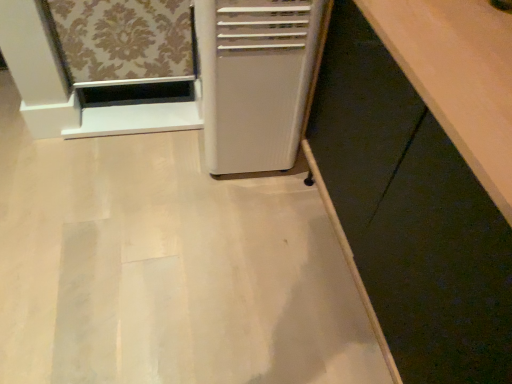
Question: Should I look upward or downward to see white plastic air conditioner at center?

Choices:
 (A) up
 (B) down

Answer: (A)

Question: Is matte white cabinet at lower right far from white plastic air conditioner at center?

Choices:
 (A) yes
 (B) no

Answer: (B)

Question: Would you say white plastic air conditioner at center is part of matte white cabinet at lower right's contents?

Choices:
 (A) no
 (B) yes

Answer: (A)

Question: Is matte white cabinet at lower right taller than white plastic air conditioner at center?

Choices:
 (A) yes
 (B) no

Answer: (A)

Question: Can you confirm if matte white cabinet at lower right is shorter than white plastic air conditioner at center?

Choices:
 (A) no
 (B) yes

Answer: (A)

Question: Is matte white cabinet at lower right positioned behind white plastic air conditioner at center?

Choices:
 (A) yes
 (B) no

Answer: (B)

Question: Is matte white cabinet at lower right positioned with its back to white plastic air conditioner at center?

Choices:
 (A) yes
 (B) no

Answer: (B)

Question: Considering the relative sizes of white plastic air conditioner at center and matte white cabinet at lower right in the image provided, is white plastic air conditioner at center shorter than matte white cabinet at lower right?

Choices:
 (A) no
 (B) yes

Answer: (B)

Question: From a real-world perspective, is white plastic air conditioner at center located beneath matte white cabinet at lower right?

Choices:
 (A) no
 (B) yes

Answer: (B)

Question: Would you say white plastic air conditioner at center is outside matte white cabinet at lower right?

Choices:
 (A) no
 (B) yes

Answer: (B)

Question: Is white plastic air conditioner at center positioned in front of matte white cabinet at lower right?

Choices:
 (A) yes
 (B) no

Answer: (B)

Question: From the image's perspective, is white plastic air conditioner at center located above matte white cabinet at lower right?

Choices:
 (A) yes
 (B) no

Answer: (A)

Question: Is white plastic air conditioner at center to the right of matte white cabinet at lower right from the viewer's perspective?

Choices:
 (A) no
 (B) yes

Answer: (A)

Question: Is white plastic air conditioner at center inside the boundaries of matte white cabinet at lower right, or outside?

Choices:
 (A) inside
 (B) outside

Answer: (B)